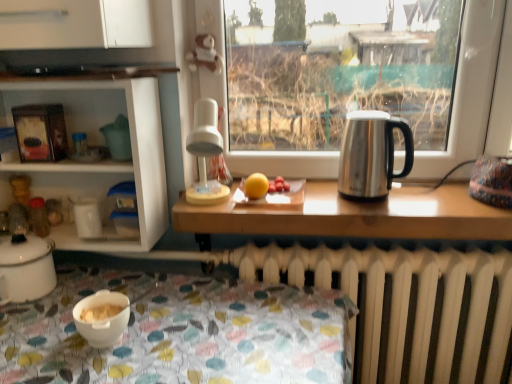
The width and height of the screenshot is (512, 384). Find the location of `free location to the right of yellow matte orange at center`. free location to the right of yellow matte orange at center is located at coordinates (287, 198).